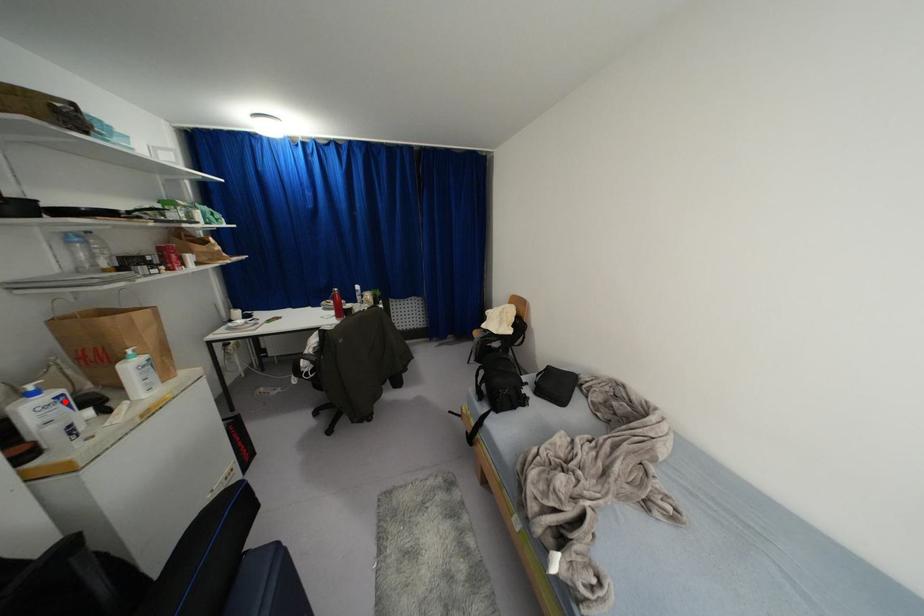
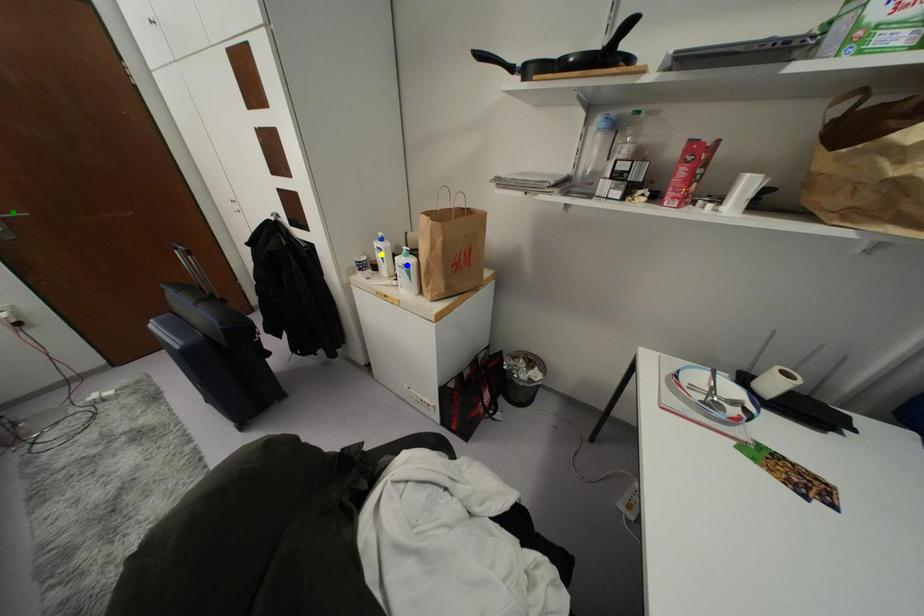
Question: I am providing you with two images of the same scene from different viewpoints. A red point is marked on the first image. You are given multiple points on the second image. Which mark in image 2 goes with the point in image 1?

Choices:
 (A) green point
 (B) yellow point
 (C) blue point

Answer: (B)